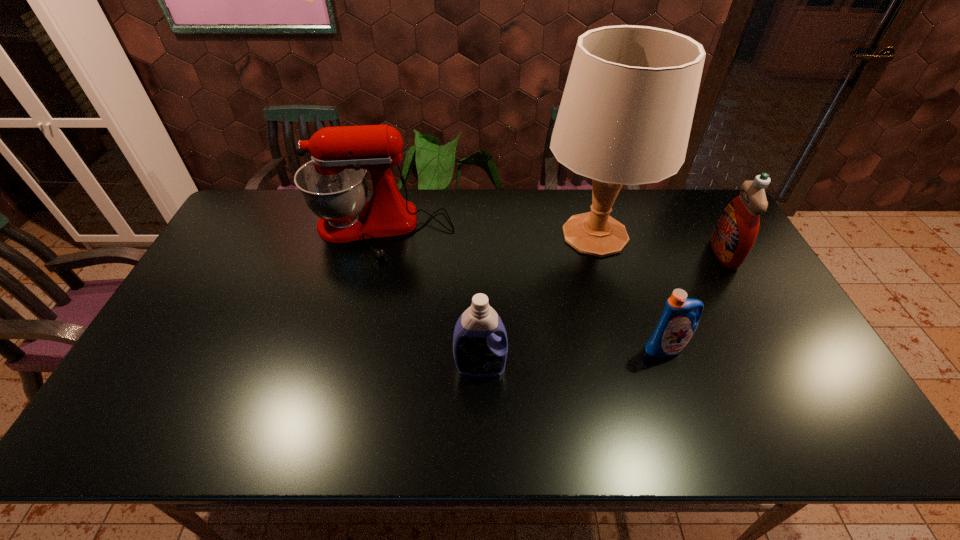
Where is `the tallest object`? the tallest object is located at coordinates coord(625,117).

Locate an element on the screen. The width and height of the screenshot is (960, 540). the leftmost object is located at coordinates (334, 185).

This screenshot has width=960, height=540. I want to click on the rightmost detergent, so click(x=734, y=235).

The height and width of the screenshot is (540, 960). In order to click on the rightmost object in this screenshot , I will do `click(734, 235)`.

The image size is (960, 540). Identify the location of the fourth object from right to left. (478, 352).

The width and height of the screenshot is (960, 540). What are the coordinates of `the second detergent from left to right` in the screenshot? It's located at (678, 322).

I want to click on the shortest object, so click(678, 322).

At what (x,y) coordinates should I click in order to perform the action: click on vacant space situated 0.250m on the front of the tallest object. Please return your answer as a coordinate pair (x, y). This screenshot has height=540, width=960. Looking at the image, I should click on point(625,342).

Image resolution: width=960 pixels, height=540 pixels. I want to click on vacant region located on the bowl side of the mixer, so click(367, 284).

This screenshot has height=540, width=960. I want to click on free space located on the front surface of the farthest detergent, so click(x=665, y=254).